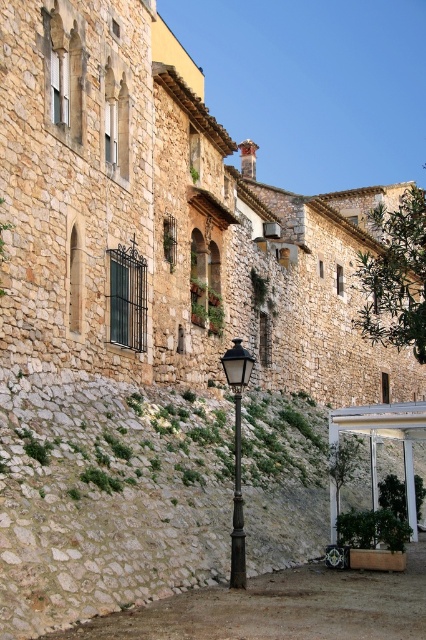
Question: Among these objects, which one is farthest from the camera?

Choices:
 (A) rustic stone wall at center
 (B) polished bronze streetlamp at center

Answer: (B)

Question: Which of the following is the farthest from the observer?

Choices:
 (A) rustic stone wall at center
 (B) polished bronze streetlamp at center

Answer: (B)

Question: Does rustic stone wall at center have a larger size compared to polished bronze streetlamp at center?

Choices:
 (A) no
 (B) yes

Answer: (B)

Question: Can you confirm if rustic stone wall at center is positioned above polished bronze streetlamp at center?

Choices:
 (A) no
 (B) yes

Answer: (A)

Question: Is rustic stone wall at center bigger than polished bronze streetlamp at center?

Choices:
 (A) no
 (B) yes

Answer: (B)